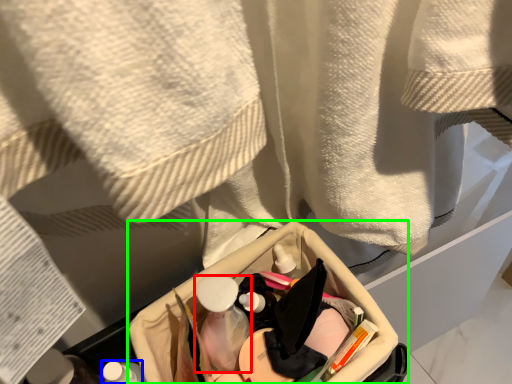
Question: Which object is positioned farthest from mouthwash (highlighted by a red box)? Select from toiletry (highlighted by a blue box) and storage box (highlighted by a green box).

Choices:
 (A) toiletry
 (B) storage box

Answer: (A)